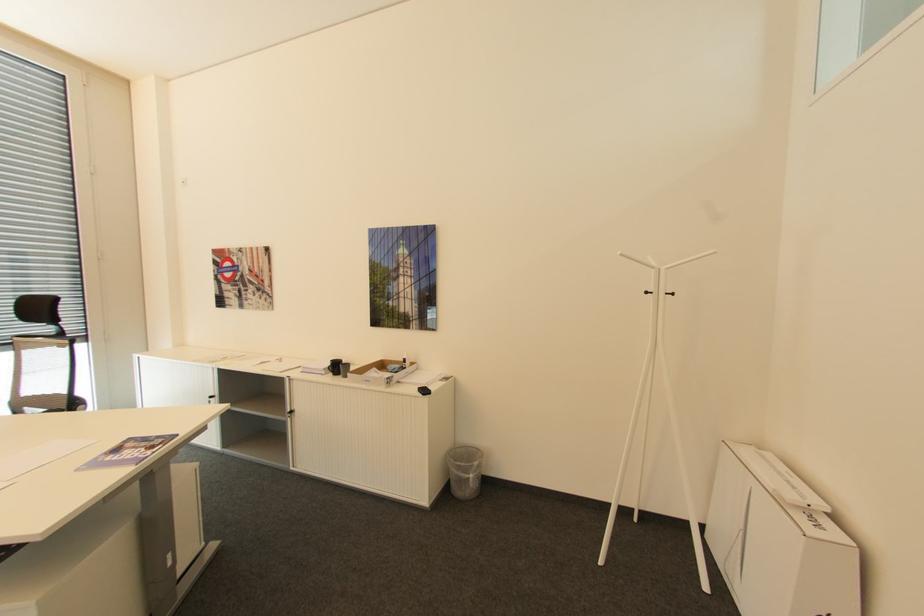
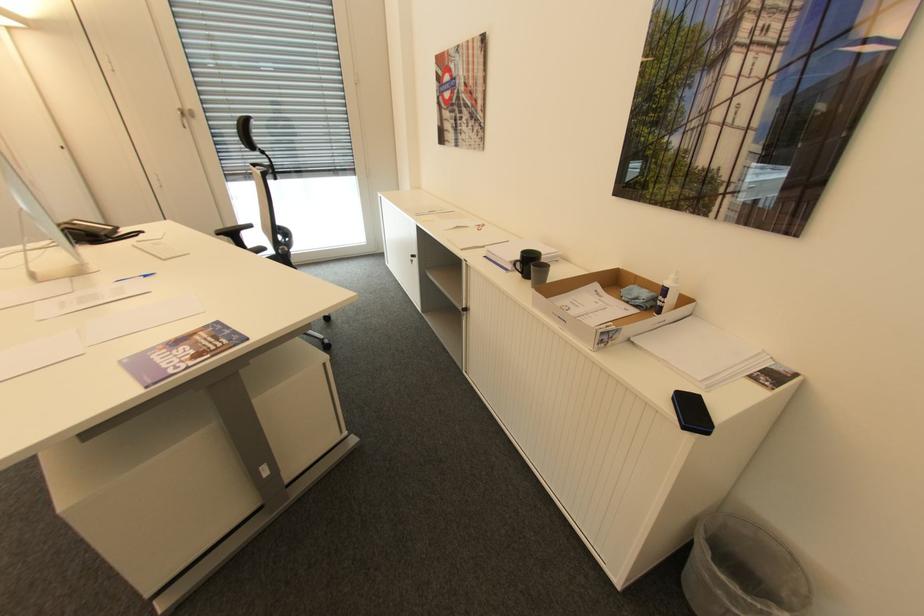
Question: I am providing you with two images of the same scene from different viewpoints. After the viewpoint changes to image2, which objects are now occluded?

Choices:
 (A) silver door handle
 (B) black mug
 (C) black smartphone
 (D) none of these

Answer: (D)